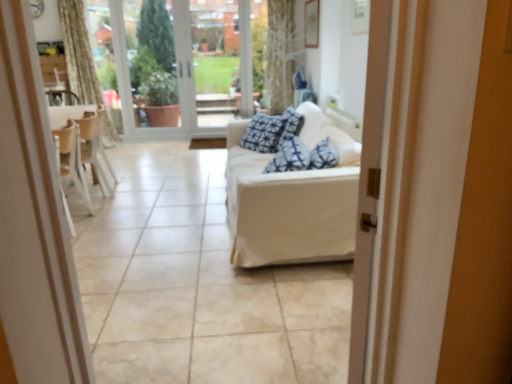
Where is `unoccupied region to the right of wooden chair at left`? The width and height of the screenshot is (512, 384). unoccupied region to the right of wooden chair at left is located at coordinates (132, 190).